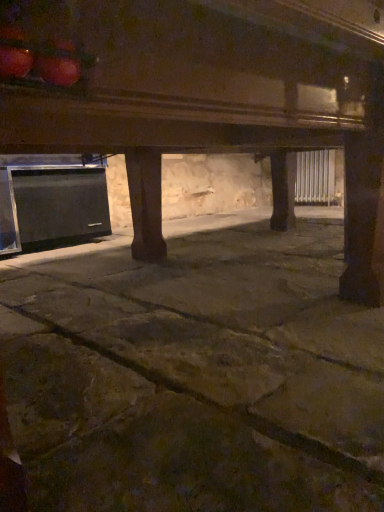
Describe the element at coordinates (205, 96) in the screenshot. The width and height of the screenshot is (384, 512). I see `matte black table at center` at that location.

The width and height of the screenshot is (384, 512). What are the coordinates of `matte black table at center` in the screenshot? It's located at (205, 96).

Identify the location of matte black table at center. This screenshot has height=512, width=384. pyautogui.click(x=205, y=96).